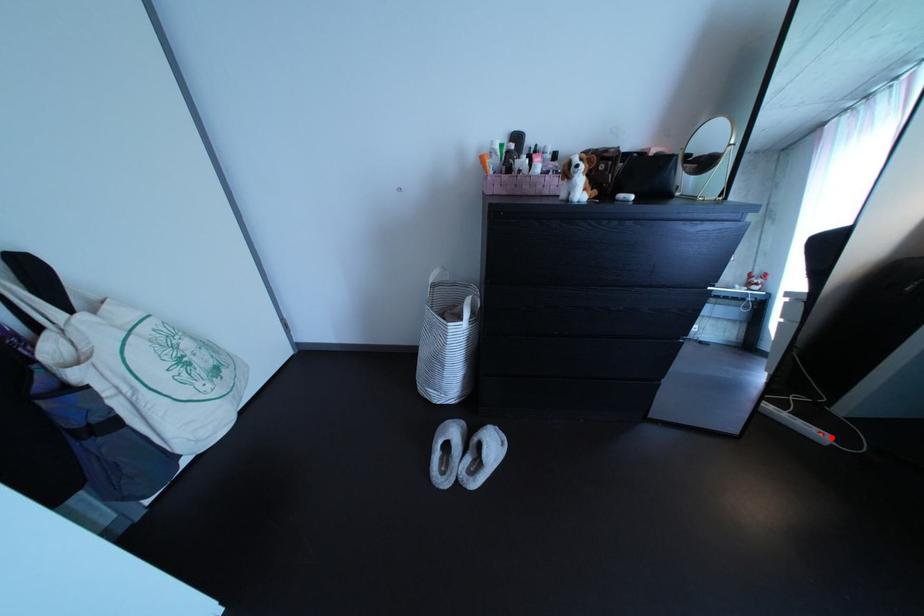
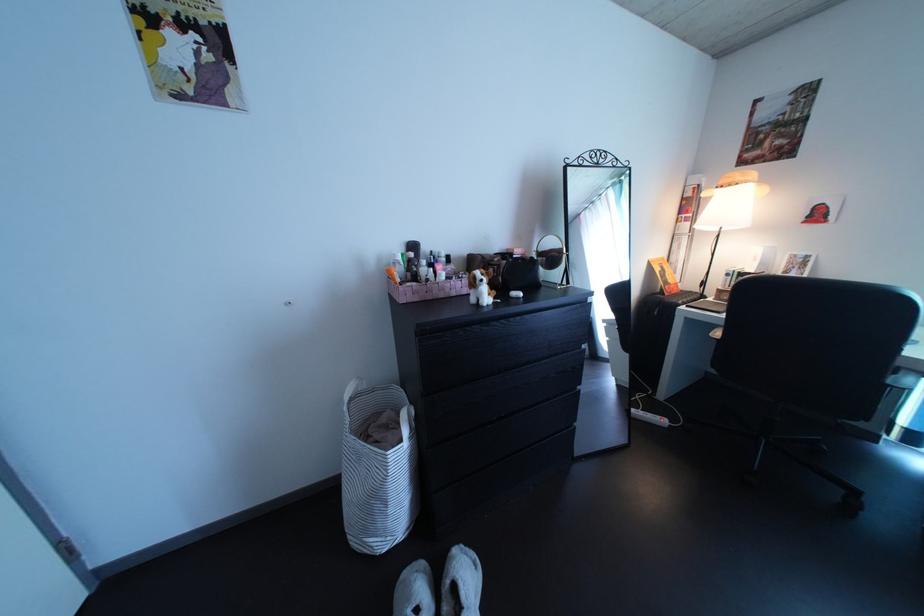
In the second image, find the point that corresponds to the highlighted location in the first image.

(673, 424)